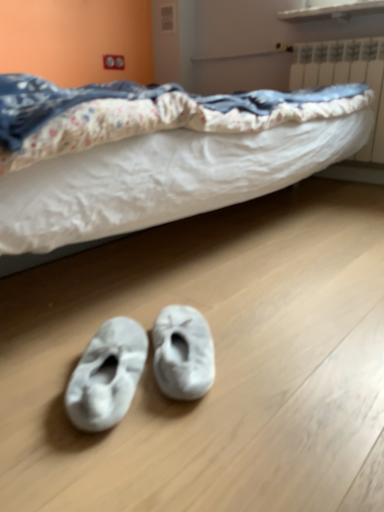
The image size is (384, 512). I want to click on unoccupied area in front of white fuzzy slippers at lower center, the 1th footwear viewed from the right, so coord(194,443).